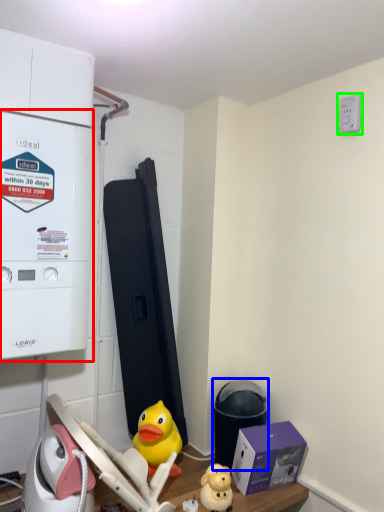
Question: Based on their relative distances, which object is farther from appliance (highlighted by a red box)? Choose from water heater (highlighted by a blue box) and electric outlet (highlighted by a green box).

Choices:
 (A) water heater
 (B) electric outlet

Answer: (B)